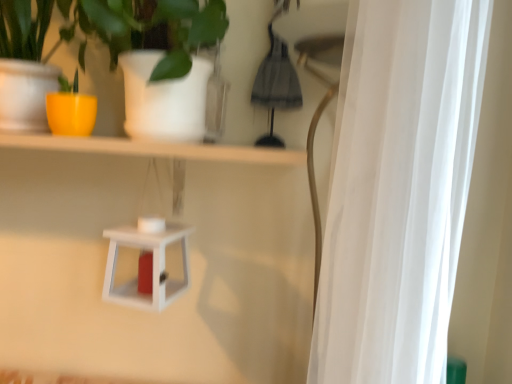
The height and width of the screenshot is (384, 512). In order to click on white sheer curtain at right in this screenshot , I will do `click(398, 189)`.

Describe the element at coordinates (115, 29) in the screenshot. I see `yellow matte pot at left` at that location.

The width and height of the screenshot is (512, 384). I want to click on white sheer curtain at right, so pyautogui.click(x=398, y=189).

Measure the distance between white sheer curtain at right and white matte lantern at center.

white sheer curtain at right is 21.55 inches from white matte lantern at center.

Can you tell me how much white sheer curtain at right and white matte lantern at center differ in facing direction?

The angle between the facing direction of white sheer curtain at right and the facing direction of white matte lantern at center is 75.2 degrees.

Which is behind, point (341, 335) or point (164, 258)?

Point (164, 258)

Who is shorter, white sheer curtain at right or white matte lantern at center?

With less height is white matte lantern at center.

Which object is wider, white matte lantern at center or yellow matte pot at left?

yellow matte pot at left is wider.

Looking at this image, is white matte lantern at center turned away from yellow matte pot at left?

No, yellow matte pot at left is not at the back of white matte lantern at center.

Considering the sizes of objects white matte lantern at center and yellow matte pot at left in the image provided, who is smaller, white matte lantern at center or yellow matte pot at left?

white matte lantern at center.

Is white matte lantern at center with yellow matte pot at left?

No, white matte lantern at center is not next to yellow matte pot at left.

Is white sheer curtain at right oriented towards yellow matte pot at left?

Yes, white sheer curtain at right is aimed at yellow matte pot at left.

From the image's perspective, would you say white sheer curtain at right is shown under yellow matte pot at left?

Indeed, from the image's perspective, white sheer curtain at right is shown beneath yellow matte pot at left.

From a real-world perspective, is white sheer curtain at right above or below yellow matte pot at left?

In terms of real-world spatial position, white sheer curtain at right is below yellow matte pot at left.

Considering the points (414, 278) and (1, 17), which point is behind, point (414, 278) or point (1, 17)?

The point (1, 17) is farther from the camera.

Is yellow matte pot at left looking in the opposite direction of white matte lantern at center?

No.

Consider the image. From the image's perspective, which one is positioned higher, yellow matte pot at left or white matte lantern at center?

From the image's view, yellow matte pot at left is above.

Is yellow matte pot at left at the left side of white matte lantern at center?

No, yellow matte pot at left is not to the left of white matte lantern at center.

Is yellow matte pot at left far from white matte lantern at center?

yellow matte pot at left is actually quite close to white matte lantern at center.

Which object is further away from the camera taking this photo, white matte lantern at center or white sheer curtain at right?

white matte lantern at center is more distant.

You are a GUI agent. You are given a task and a screenshot of the screen. Output one action in this format:
    pyautogui.click(x=<x>, y=<y>)
    Task: Click on the curtain in front of the white matte lantern at center
    This screenshot has width=512, height=384.
    Given the screenshot: What is the action you would take?
    pyautogui.click(x=398, y=189)

Which object is positioned more to the right, white matte lantern at center or white sheer curtain at right?

white sheer curtain at right is more to the right.

Is white matte lantern at center with white sheer curtain at right?

white matte lantern at center and white sheer curtain at right are not in contact.

Is point (83, 7) positioned behind point (398, 205)?

Yes, it is behind point (398, 205).

Is yellow matte pot at left not within white sheer curtain at right?

yellow matte pot at left is positioned outside white sheer curtain at right.

Is white sheer curtain at right at the back of yellow matte pot at left?

yellow matte pot at left does not have its back to white sheer curtain at right.

Can you confirm if yellow matte pot at left is shorter than white sheer curtain at right?

Correct, yellow matte pot at left is not as tall as white sheer curtain at right.

Where is `shelf below the white sheer curtain at right (from a real-world perspective)`? The image size is (512, 384). shelf below the white sheer curtain at right (from a real-world perspective) is located at coordinates (152, 266).

Identify the location of houseplant lying above the white matte lantern at center (from the image's perspective). Image resolution: width=512 pixels, height=384 pixels. (115, 29).

Based on their spatial positions, is white sheer curtain at right or white matte lantern at center closer to yellow matte pot at left?

Based on the image, white matte lantern at center appears to be nearer to yellow matte pot at left.

Which object lies nearer to the anchor point white matte lantern at center, white sheer curtain at right or yellow matte pot at left?

yellow matte pot at left.

Considering their positions, is white matte lantern at center positioned further to yellow matte pot at left than white sheer curtain at right?

Based on the image, white sheer curtain at right appears to be further to yellow matte pot at left.

Which object lies further to the anchor point white matte lantern at center, yellow matte pot at left or white sheer curtain at right?

Among the two, white sheer curtain at right is located further to white matte lantern at center.

Based on the photo, which object lies nearer to the anchor point white sheer curtain at right, white matte lantern at center or yellow matte pot at left?

yellow matte pot at left is closer to white sheer curtain at right.

When comparing their distances from white sheer curtain at right, does yellow matte pot at left or white matte lantern at center seem closer?

The object closer to white sheer curtain at right is yellow matte pot at left.

At what (x,y) coordinates should I click in order to perform the action: click on houseplant between white sheer curtain at right and white matte lantern at center along the z-axis. Please return your answer as a coordinate pair (x, y). This screenshot has width=512, height=384. Looking at the image, I should click on (115, 29).